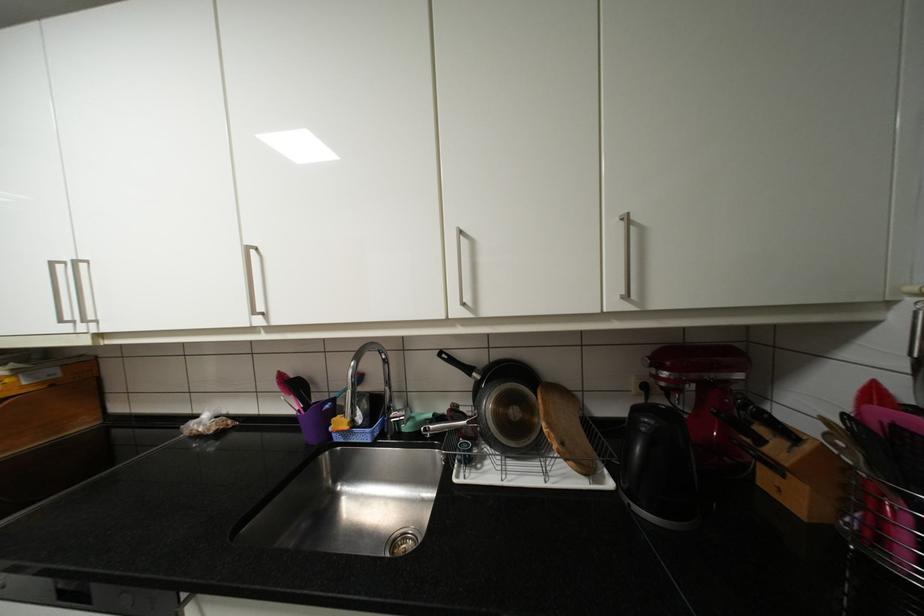
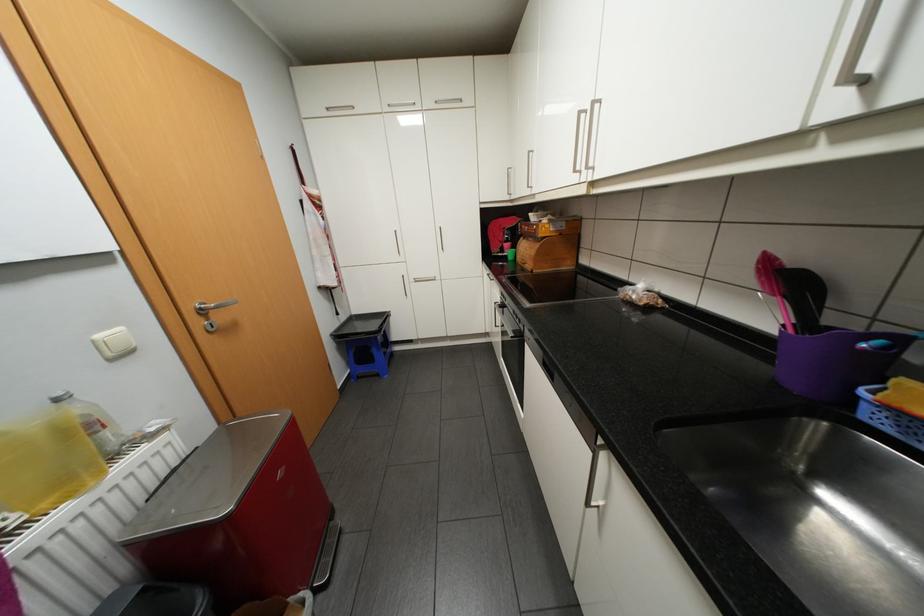
The first image is from the beginning of the video and the second image is from the end. How did the camera likely rotate when shooting the video?

The rotation direction of the camera is left-down.